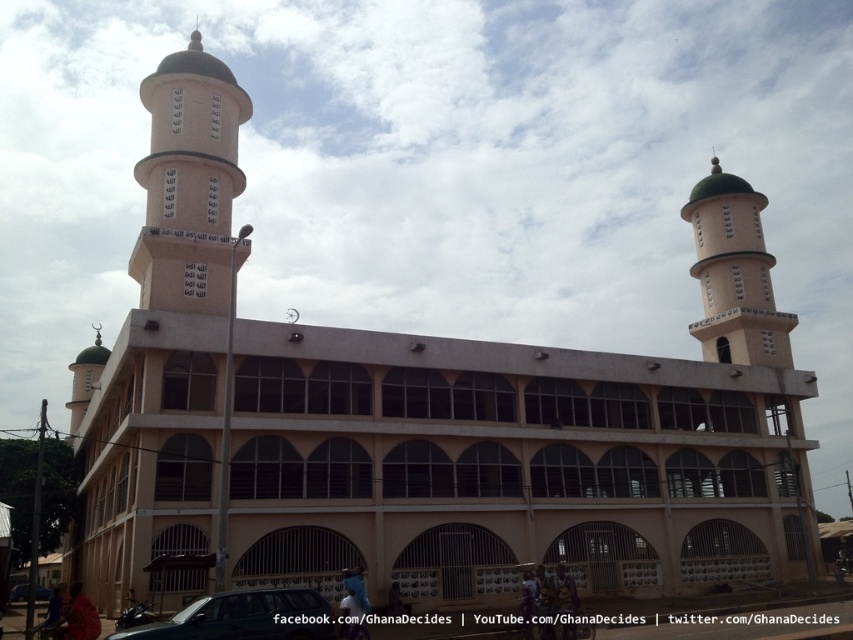
Is point (317, 627) positioned in front of point (83, 385)?

Yes, it is.

Does metallic car at center lie in front of matte white minaret at left?

Yes, metallic car at center is closer to the viewer.

Which is behind, point (314, 612) or point (79, 412)?

Positioned behind is point (79, 412).

Where is `metallic car at center`? This screenshot has height=640, width=853. metallic car at center is located at coordinates (242, 618).

Does metallic car at center have a greater height compared to metallic silver car at lower left?

No.

Between metallic car at center and metallic silver car at lower left, which one is positioned lower?

Positioned lower is metallic silver car at lower left.

Does point (283, 605) come closer to viewer compared to point (22, 596)?

Yes, it is.

You are a GUI agent. You are given a task and a screenshot of the screen. Output one action in this format:
    pyautogui.click(x=<x>, y=<y>)
    Task: Click on the metallic car at center
    
    Given the screenshot: What is the action you would take?
    pyautogui.click(x=242, y=618)

Which is behind, point (94, 358) or point (12, 592)?

The point (94, 358) is more distant.

Does matte white minaret at left appear on the right side of metallic silver car at lower left?

No, matte white minaret at left is not to the right of metallic silver car at lower left.

Is point (79, 397) closer to camera compared to point (9, 600)?

No, (79, 397) is behind (9, 600).

Locate an element on the screen. matte white minaret at left is located at coordinates (85, 378).